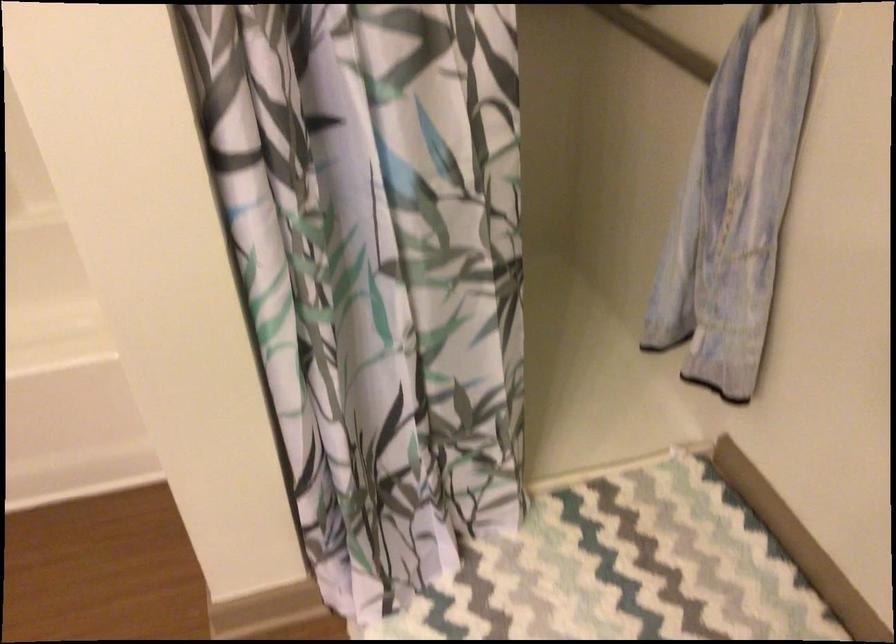
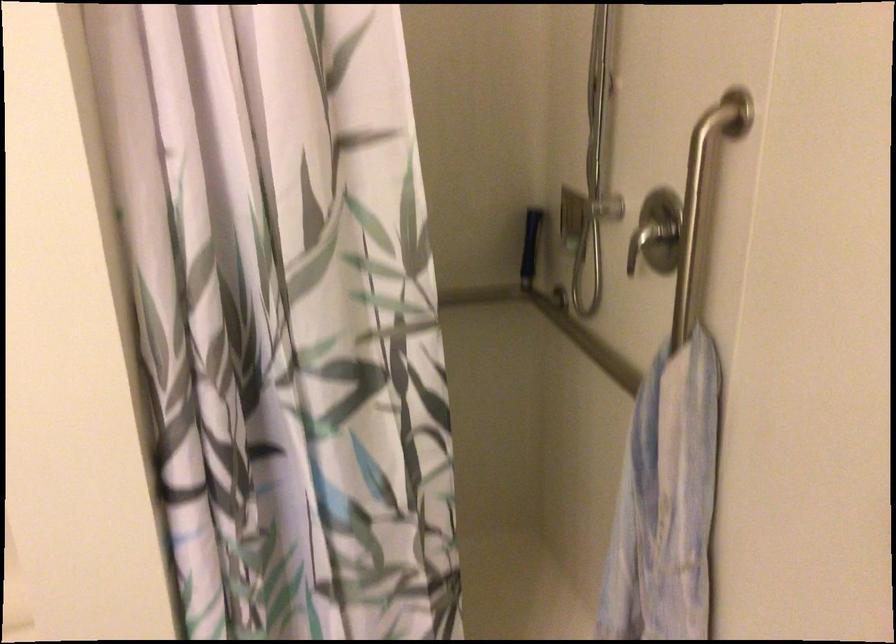
Which direction would the cameraman need to move to produce the second image?

The movement direction of the cameraman is right, backward.